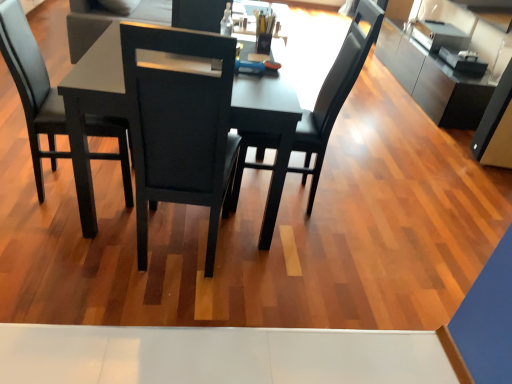
Question: Is the position of matte black table at center less distant than that of satin silver cabinet at upper right?

Choices:
 (A) yes
 (B) no

Answer: (A)

Question: Does matte black table at center come behind satin silver cabinet at upper right?

Choices:
 (A) no
 (B) yes

Answer: (A)

Question: From a real-world perspective, is matte black table at center beneath satin silver cabinet at upper right?

Choices:
 (A) yes
 (B) no

Answer: (B)

Question: Does matte black table at center appear on the right side of satin silver cabinet at upper right?

Choices:
 (A) no
 (B) yes

Answer: (A)

Question: From a real-world perspective, is matte black table at center physically above satin silver cabinet at upper right?

Choices:
 (A) yes
 (B) no

Answer: (A)

Question: Is satin silver cabinet at upper right bigger or smaller than matte black table at center?

Choices:
 (A) small
 (B) big

Answer: (A)

Question: In the image, is satin silver cabinet at upper right positioned in front of or behind matte black table at center?

Choices:
 (A) behind
 (B) front

Answer: (A)

Question: Is point (477, 104) positioned closer to the camera than point (105, 56)?

Choices:
 (A) farther
 (B) closer

Answer: (A)

Question: Choose the correct answer: Is satin silver cabinet at upper right inside matte black table at center or outside it?

Choices:
 (A) outside
 (B) inside

Answer: (A)

Question: Considering the positions of point (37, 69) and point (434, 110), is point (37, 69) closer or farther from the camera than point (434, 110)?

Choices:
 (A) farther
 (B) closer

Answer: (B)

Question: Is black leather chair at left, the first chair from the left, to the left or to the right of satin silver cabinet at upper right in the image?

Choices:
 (A) left
 (B) right

Answer: (A)

Question: Considering the positions of black leather chair at left, the first chair from the left, and satin silver cabinet at upper right in the image, is black leather chair at left, the first chair from the left, wider or thinner than satin silver cabinet at upper right?

Choices:
 (A) wide
 (B) thin

Answer: (B)

Question: Is black leather chair at left, the first chair from the left, spatially inside satin silver cabinet at upper right, or outside of it?

Choices:
 (A) outside
 (B) inside

Answer: (A)

Question: Does point (481, 46) appear closer or farther from the camera than point (25, 94)?

Choices:
 (A) closer
 (B) farther

Answer: (B)

Question: From the image's perspective, is satin silver cabinet at upper right positioned above or below black leather chair at left, the first chair from the left?

Choices:
 (A) above
 (B) below

Answer: (A)